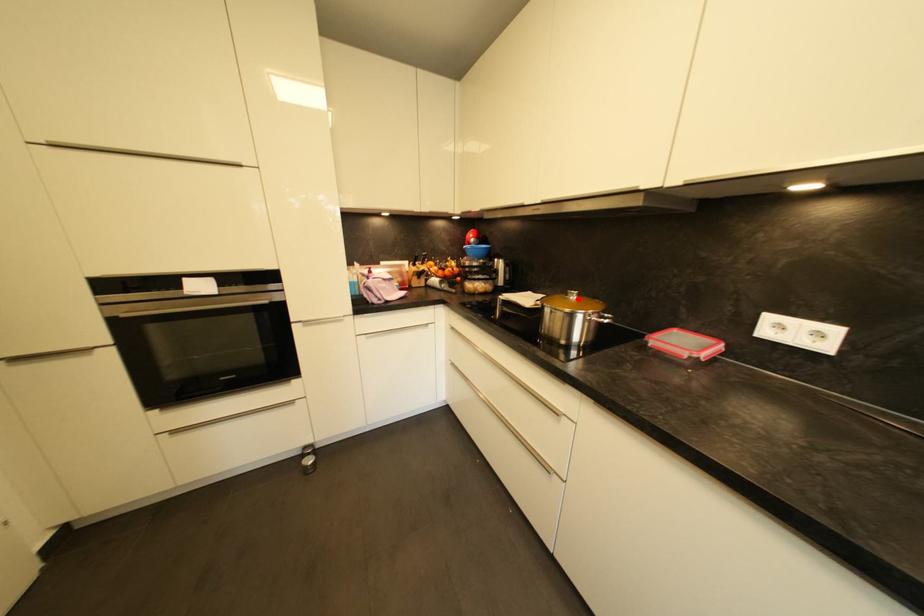
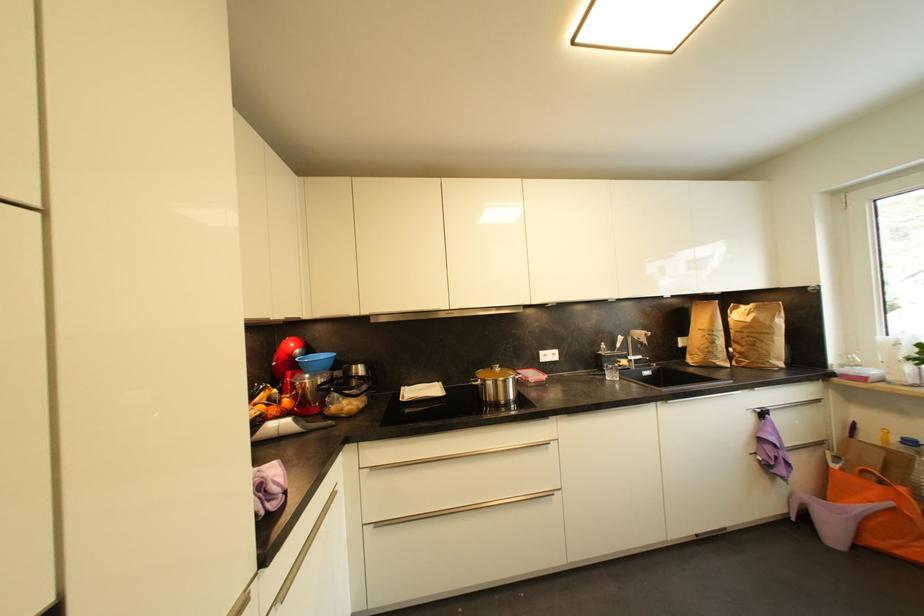
Question: I am providing you with two images of the same scene from different viewpoints. A red point is marked on the first image. At the location where the point appears in image 1, is it still visible in image 2?

Choices:
 (A) Yes
 (B) No

Answer: (A)